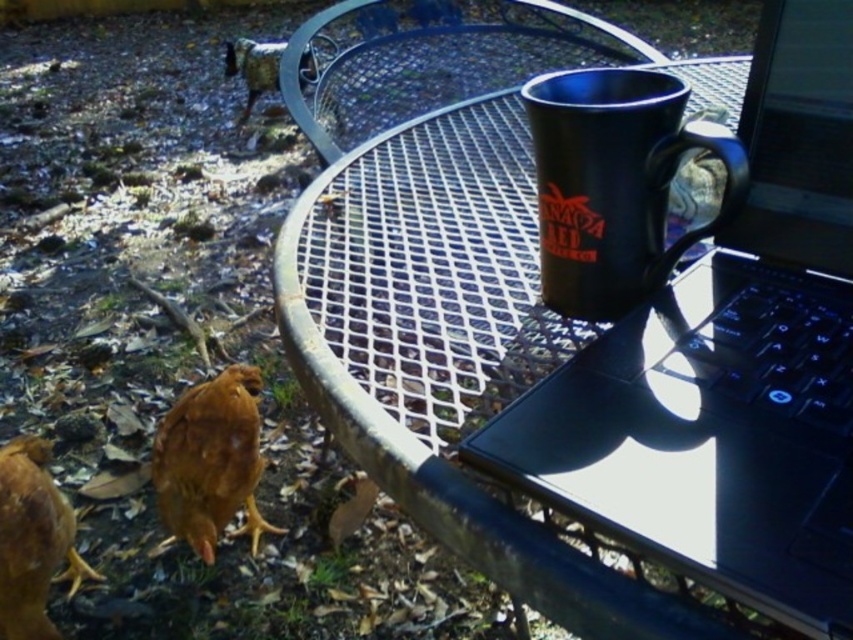
Question: Can you confirm if metallic mesh table at center is positioned to the left of black matte mug at upper center?

Choices:
 (A) no
 (B) yes

Answer: (B)

Question: Is metallic mesh table at center positioned at the back of brown matte chicken at lower left?

Choices:
 (A) no
 (B) yes

Answer: (A)

Question: Is black matte mug at upper center to the left of brown matte chicken at lower left from the viewer's perspective?

Choices:
 (A) no
 (B) yes

Answer: (A)

Question: Considering the real-world distances, which object is farthest from the metallic mesh table at center?

Choices:
 (A) brown matte chicken at lower left
 (B) black matte mug at upper center
 (C) golden brown feathers at lower left

Answer: (C)

Question: Among these objects, which one is farthest from the camera?

Choices:
 (A) metallic mesh table at center
 (B) golden brown feathers at lower left
 (C) brown matte chicken at lower left
 (D) black matte mug at upper center

Answer: (C)

Question: Which point appears closest to the camera in this image?

Choices:
 (A) (827, 388)
 (B) (583, 148)

Answer: (A)